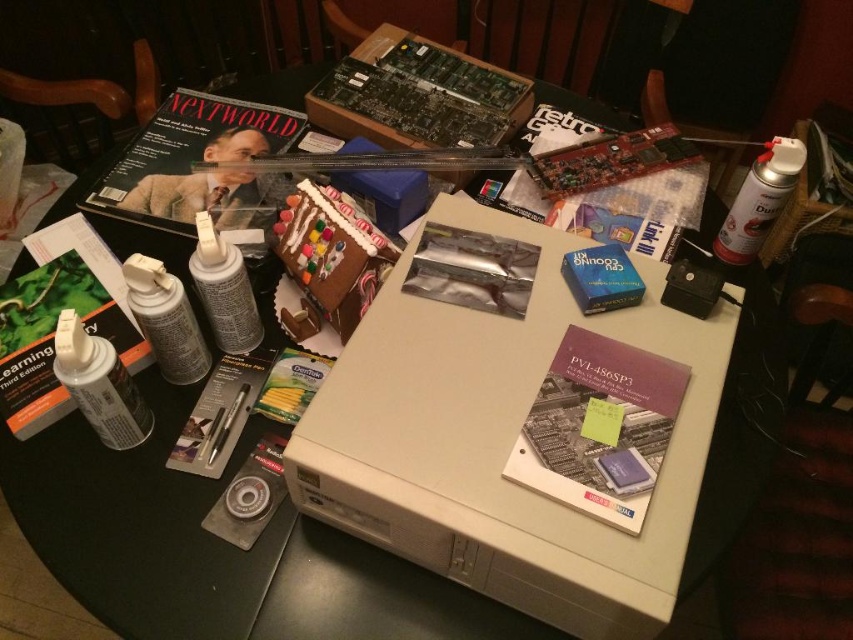
Consider the image. You are organizing items on a table and need to place the matte black magazine at upper center and the matte white spray can at left. If the magazine is wider than the spray can, which item requires more horizontal space?

The matte black magazine at upper center requires more horizontal space because it is wider than the matte white spray can at left.

You are an artist preparing to paint a large mural. You have two white matte spray cans on your cluttered workspace table. The spray cans are labeled as white matte spray can at lower left and white matte spray can at upper right. Given that your spray can holder can only hold items up to 30 inches apart, will both spray cans fit into the holder?

The white matte spray can at lower left and white matte spray can at upper right are 30.96 inches apart from each other. Since the distance between them exceeds the holder capacity of 30 inches, they cannot both fit into the holder.

In the scene shown: You are organizing the spray cans on the table. Which spray can is smaller between the matte white spray can at left and the white matte spray can at upper right?

The matte white spray can at left is smaller than the white matte spray can at upper right.